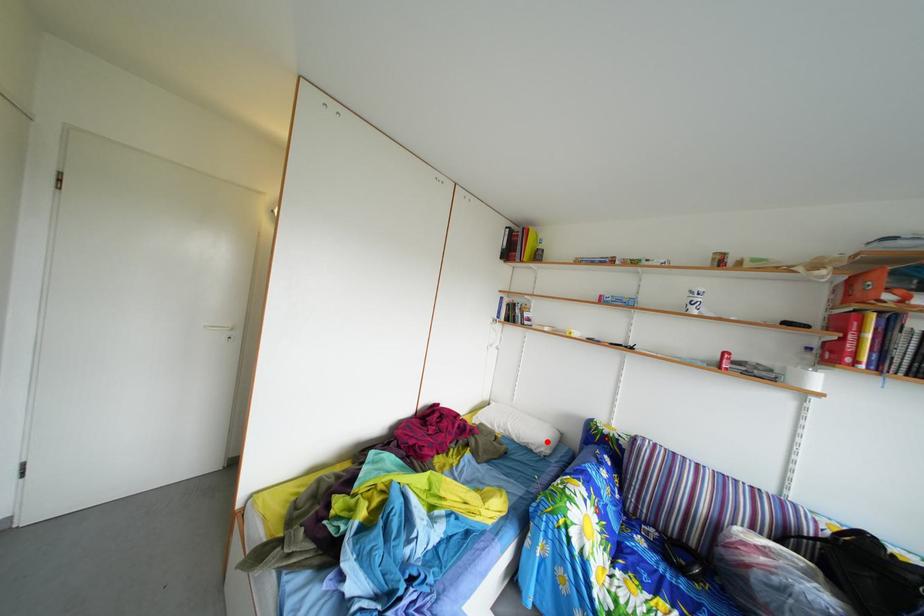
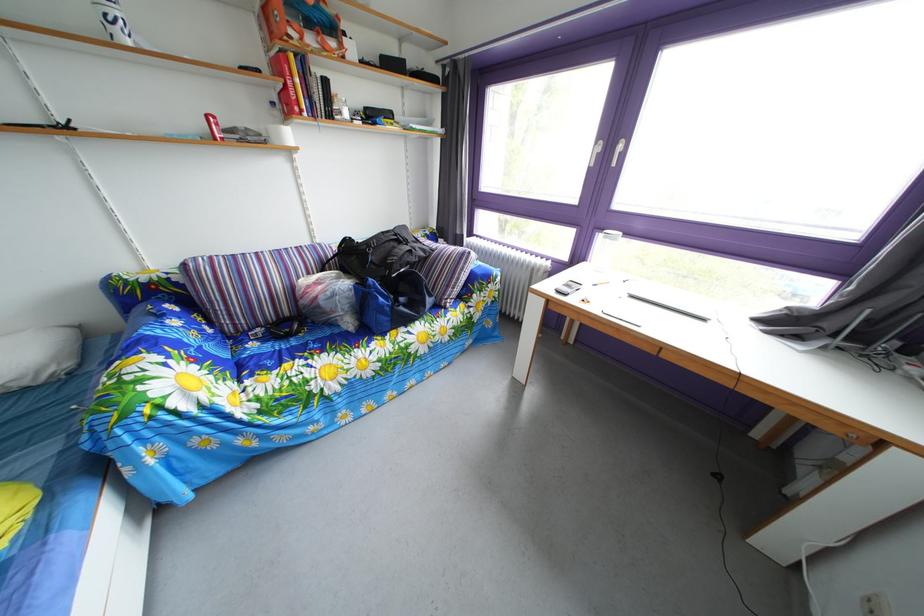
In the second image, find the point that corresponds to the highlighted location in the first image.

(18, 370)